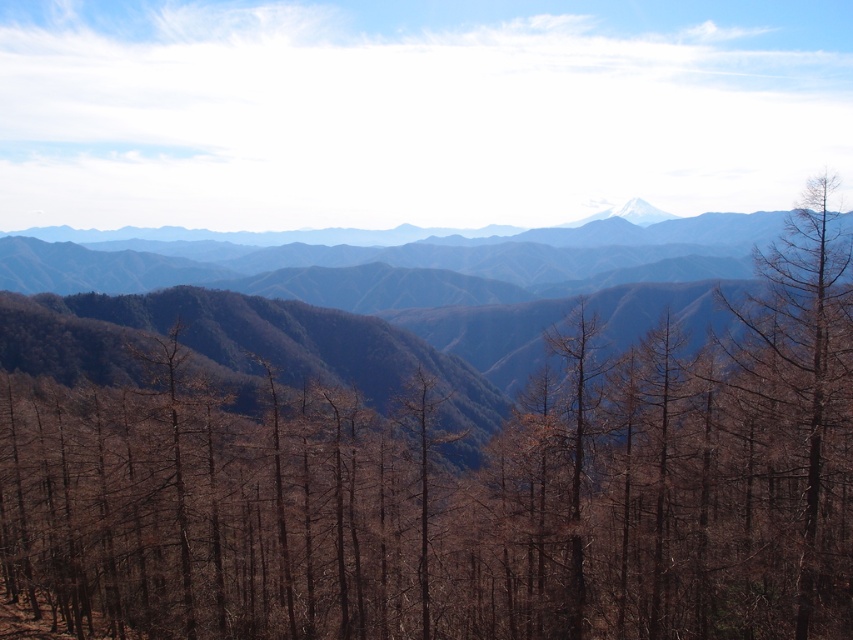
Question: Does brown matte tree at center have a lesser width compared to white snow-capped peak at center?

Choices:
 (A) yes
 (B) no

Answer: (B)

Question: Which point is closer to the camera?

Choices:
 (A) brown matte tree at center
 (B) brown matte tree at right
 (C) white snow-capped peak at center

Answer: (B)

Question: Where is brown matte tree at right located in relation to white snow-capped peak at center in the image?

Choices:
 (A) right
 (B) left

Answer: (B)

Question: Which point appears closest to the camera in this image?

Choices:
 (A) (666, 234)
 (B) (616, 211)
 (C) (73, 461)
 (D) (828, 609)

Answer: (D)

Question: Where is brown matte tree at center located in relation to brown textured mountain range at center in the image?

Choices:
 (A) below
 (B) above

Answer: (A)

Question: Which point is farther to the camera?

Choices:
 (A) (59, 291)
 (B) (450, 512)
 (C) (608, 209)
 (D) (811, 452)

Answer: (C)